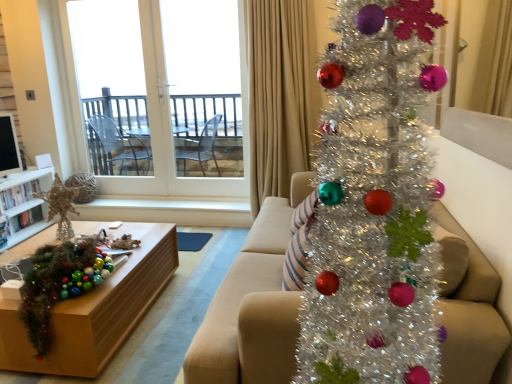
Question: Is shiny green tinsel garland at lower left smaller than beige fabric curtain at upper right?

Choices:
 (A) no
 (B) yes

Answer: (B)

Question: Can you confirm if shiny green tinsel garland at lower left is shorter than beige fabric curtain at upper right?

Choices:
 (A) yes
 (B) no

Answer: (A)

Question: Is shiny green tinsel garland at lower left positioned in front of beige fabric curtain at upper right?

Choices:
 (A) no
 (B) yes

Answer: (B)

Question: Would you say shiny green tinsel garland at lower left is outside beige fabric curtain at upper right?

Choices:
 (A) yes
 (B) no

Answer: (A)

Question: Is shiny green tinsel garland at lower left looking in the opposite direction of beige fabric curtain at upper right?

Choices:
 (A) yes
 (B) no

Answer: (B)

Question: Is shiny green tinsel garland at lower left in contact with beige fabric curtain at upper right?

Choices:
 (A) yes
 (B) no

Answer: (B)

Question: Considering the relative sizes of white glass door at upper left and shiny green tinsel garland at lower left in the image provided, is white glass door at upper left bigger than shiny green tinsel garland at lower left?

Choices:
 (A) yes
 (B) no

Answer: (A)

Question: From the image's perspective, is white glass door at upper left beneath shiny green tinsel garland at lower left?

Choices:
 (A) yes
 (B) no

Answer: (B)

Question: Can you confirm if white glass door at upper left is smaller than shiny green tinsel garland at lower left?

Choices:
 (A) no
 (B) yes

Answer: (A)

Question: Is white glass door at upper left wider than shiny green tinsel garland at lower left?

Choices:
 (A) yes
 (B) no

Answer: (B)

Question: Does white glass door at upper left lie behind shiny green tinsel garland at lower left?

Choices:
 (A) no
 (B) yes

Answer: (B)

Question: Is white glass door at upper left turned away from shiny green tinsel garland at lower left?

Choices:
 (A) yes
 (B) no

Answer: (B)

Question: Is matte beige couch at center bigger than shiny green tinsel garland at lower left?

Choices:
 (A) no
 (B) yes

Answer: (B)